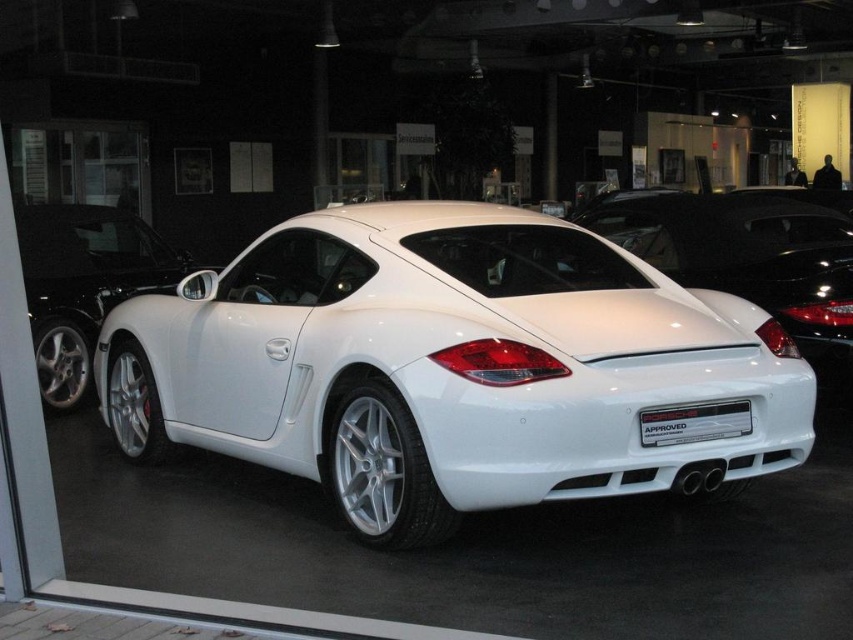
At what (x,y) coordinates should I click in order to perform the action: click on white metallic sports car at center. Please return your answer as a coordinate pair (x, y). Looking at the image, I should click on (454, 368).

Locate an element on the screen. white metallic sports car at center is located at coordinates (454, 368).

This screenshot has width=853, height=640. Describe the element at coordinates (746, 253) in the screenshot. I see `white glossy car at center` at that location.

Which is behind, point (827, 330) or point (59, 307)?

Point (59, 307)

Which is in front, point (714, 282) or point (123, 234)?

Positioned in front is point (714, 282).

Locate an element on the screen. The image size is (853, 640). white glossy car at center is located at coordinates (746, 253).

Can you confirm if white metallic sports car at center is smaller than white glossy car at center?

No, white metallic sports car at center is not smaller than white glossy car at center.

How far apart are white metallic sports car at center and white glossy car at center?

white metallic sports car at center and white glossy car at center are 8.45 feet apart.

Is point (294, 282) positioned behind point (776, 216)?

No, it is not.

I want to click on white metallic sports car at center, so click(454, 368).